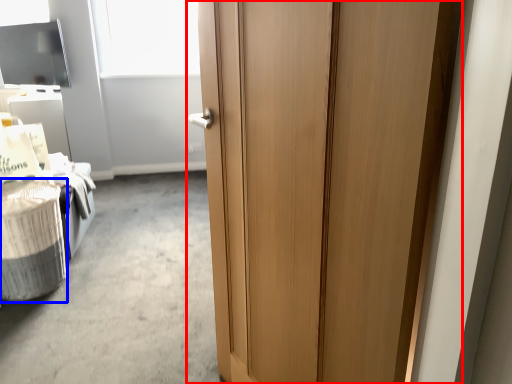
Question: Which object appears farthest to the camera in this image, door (highlighted by a red box) or laundry basket (highlighted by a blue box)?

Choices:
 (A) door
 (B) laundry basket

Answer: (B)